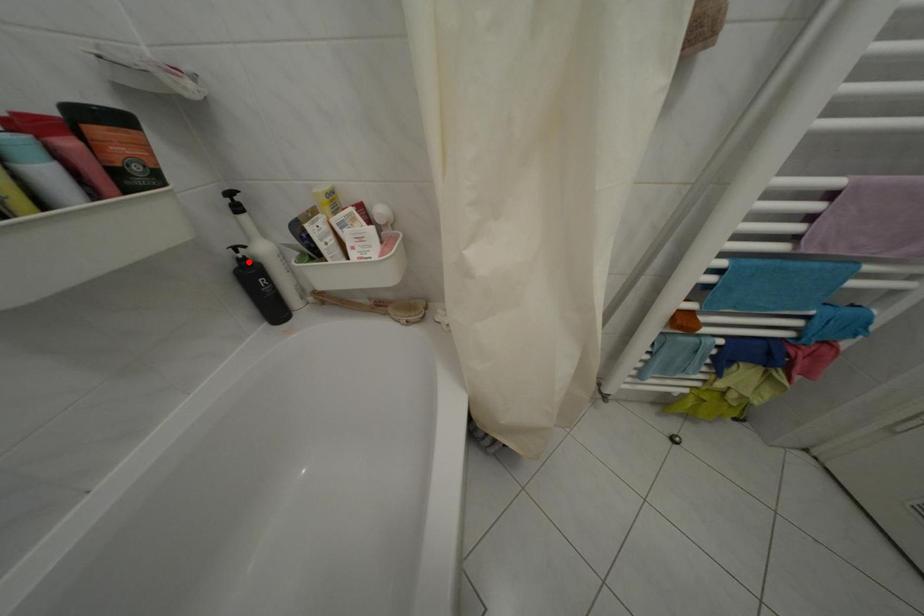
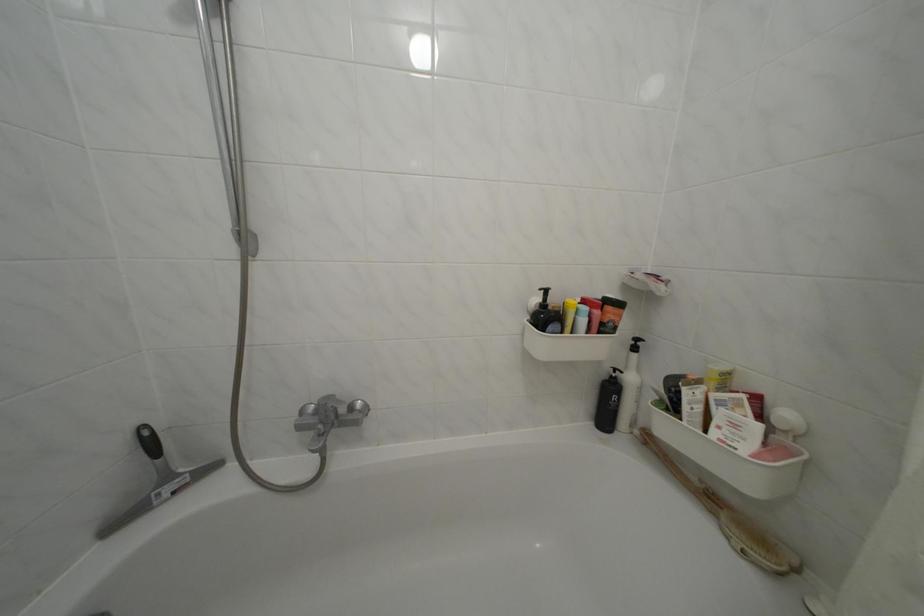
Question: I am providing you with two images of the same scene from different viewpoints. In image1, a red point is highlighted. Considering the same 3D point in image2, which of the following is correct?

Choices:
 (A) It is closer
 (B) It is farther

Answer: (B)